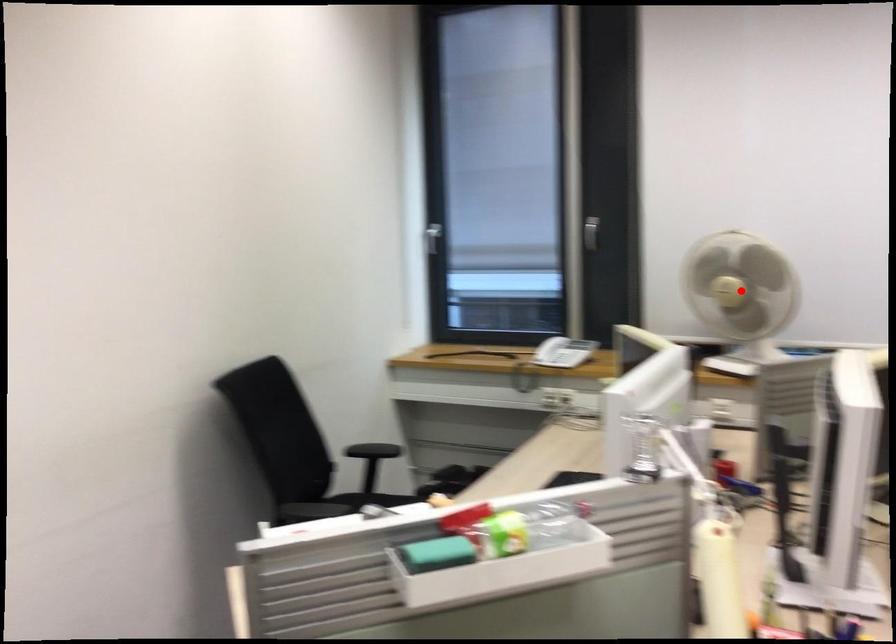
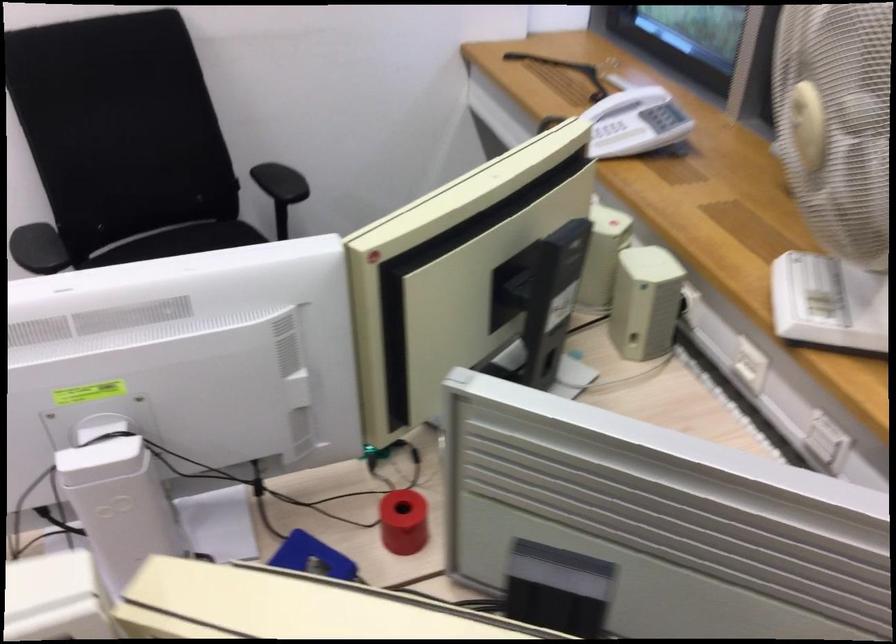
Question: I am providing you with two images of the same scene from different viewpoints. A red point is marked on the first image. Is the red point's position out of view in image 2?

Choices:
 (A) Yes
 (B) No

Answer: (A)